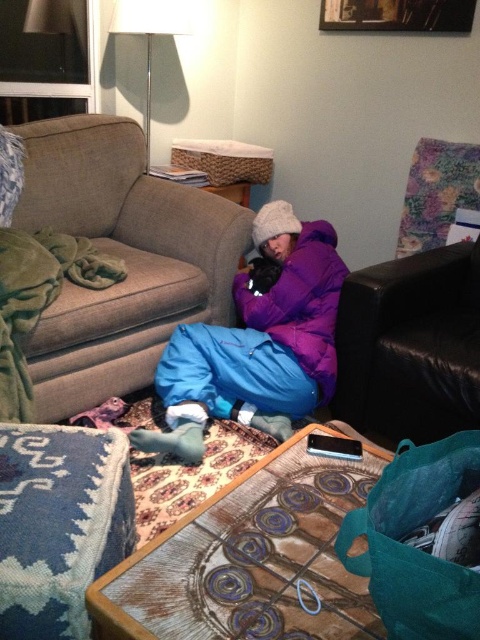
You are standing in the room and want to place a small plant pot between the black leather couch at right and the white fabric lampshade at upper center. Which object should you place the plant pot closer to if you want it to be nearer to the viewer?

The black leather couch at right is closer to the viewer than the white fabric lampshade at upper center. Therefore, to place the plant pot closer to the viewer, position it near the black leather couch at right.

You are a photographer standing in the room and want to take a photo of the two points mentioned. Which point, point (69, 388) or point (477, 278), will appear larger in the photo?

Point (69, 388) is closer to the camera than point (477, 278), so it will appear larger in the photo.